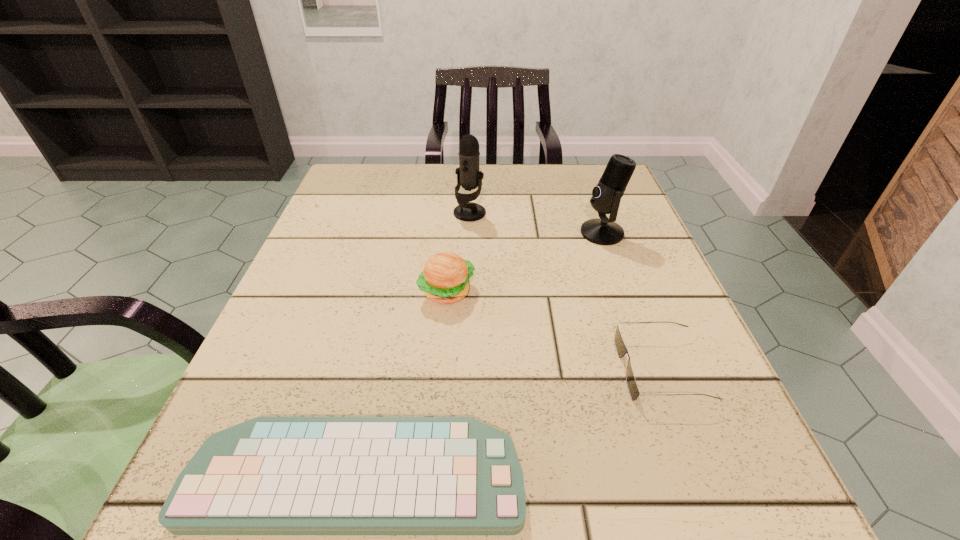
Locate an element on the screen. vacant point located on the stand of the right microphone is located at coordinates (418, 233).

Where is `vacant space located on the stand of the right microphone`? Image resolution: width=960 pixels, height=540 pixels. vacant space located on the stand of the right microphone is located at coordinates (494, 233).

Where is `vacant point located 0.240m on the right of the third shortest object`? vacant point located 0.240m on the right of the third shortest object is located at coordinates (611, 292).

Identify the location of vacant space located on the front-facing side of the sunglasses. (473, 369).

Find the location of a particular element. free space located 0.130m on the front-facing side of the sunglasses is located at coordinates (535, 369).

Identify the location of vacant space located on the front-facing side of the sunglasses. This screenshot has height=540, width=960. (493, 369).

I want to click on vacant space located 0.170m on the back of the computer keyboard, so click(x=387, y=331).

Where is `object that is at the far edge`? This screenshot has width=960, height=540. object that is at the far edge is located at coordinates (468, 176).

Where is `object located in the near edge section of the desktop`? Image resolution: width=960 pixels, height=540 pixels. object located in the near edge section of the desktop is located at coordinates (269, 475).

The image size is (960, 540). I want to click on object at the left edge, so click(x=269, y=475).